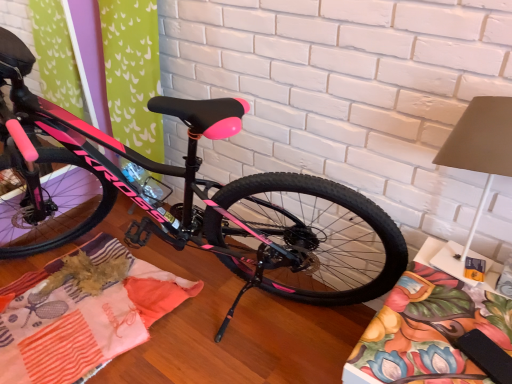
Question: Is pink glossy bicycle at center in front of or behind floral fabric cushion at lower right, arranged as the first blanket when viewed from the right, in the image?

Choices:
 (A) front
 (B) behind

Answer: (A)

Question: Is pink glossy bicycle at center inside or outside of floral fabric cushion at lower right, arranged as the first blanket when viewed from the right?

Choices:
 (A) outside
 (B) inside

Answer: (A)

Question: Estimate the real-world distances between objects in this image. Which object is farther from the patchwork fabric at center, which is counted as the second blanket, starting from the right?

Choices:
 (A) pink glossy bicycle at center
 (B) floral fabric cushion at lower right, which appears as the 2th blanket when viewed from the left

Answer: (B)

Question: Which object is positioned closest to the patchwork fabric at center, which appears as the first blanket when viewed from the left?

Choices:
 (A) pink glossy bicycle at center
 (B) floral fabric cushion at lower right, which appears as the 2th blanket when viewed from the left

Answer: (A)